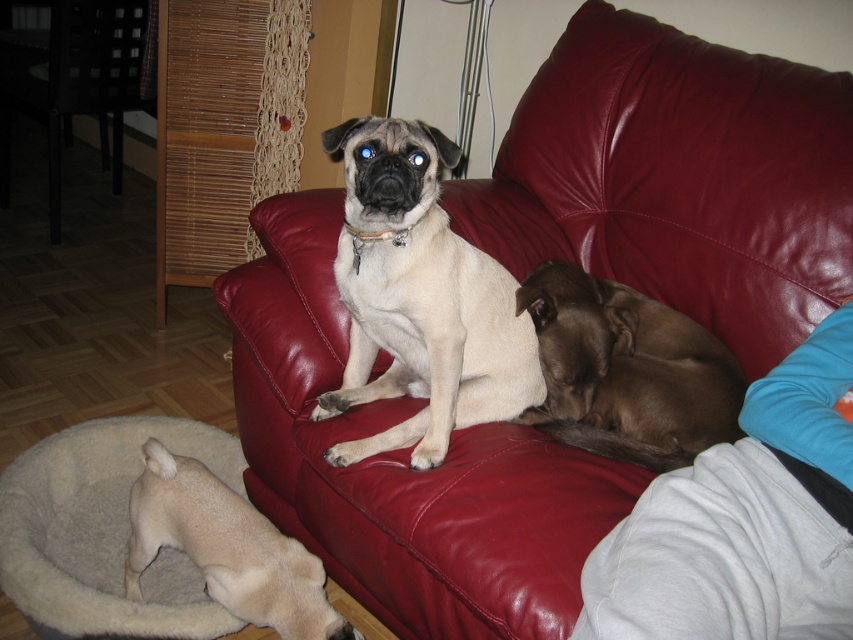
Which of these two, white fur dog at center or beige plush dog bed at lower left, stands shorter?

beige plush dog bed at lower left

I want to click on white fur dog at center, so click(x=421, y=298).

Where is `white fur dog at center`? white fur dog at center is located at coordinates (421, 298).

Does beige plush dog bed at lower left appear on the left side of brown smooth dog at center?

Correct, you'll find beige plush dog bed at lower left to the left of brown smooth dog at center.

Is the position of beige plush dog bed at lower left more distant than that of brown smooth dog at center?

Yes, it is.

Who is more distant from viewer, (45, 483) or (693, 444)?

Point (45, 483)

The height and width of the screenshot is (640, 853). In order to click on beige plush dog bed at lower left in this screenshot , I will do `click(103, 531)`.

Can you confirm if leather couch at center is positioned to the right of brown smooth dog at center?

Correct, you'll find leather couch at center to the right of brown smooth dog at center.

This screenshot has width=853, height=640. Identify the location of leather couch at center. (677, 179).